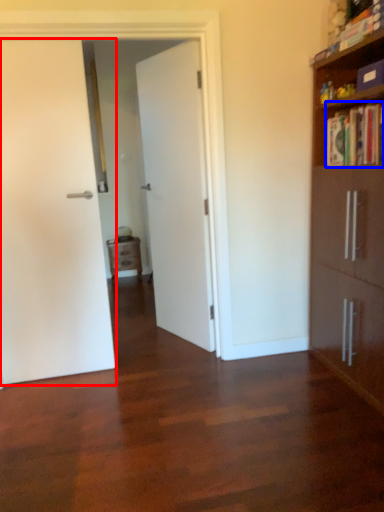
Question: Which object appears closest to the camera in this image, door (highlighted by a red box) or book (highlighted by a blue box)?

Choices:
 (A) door
 (B) book

Answer: (B)